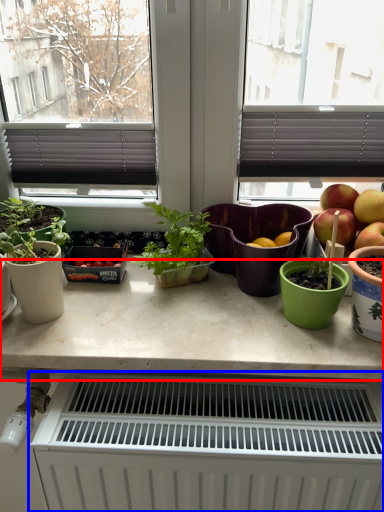
Question: Which object is closer to the camera taking this photo, countertop (highlighted by a red box) or radiator (highlighted by a blue box)?

Choices:
 (A) countertop
 (B) radiator

Answer: (B)